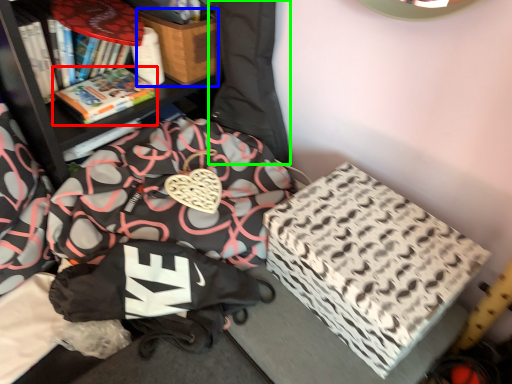
Question: Which object is positioned closest to book (highlighted by a red box)? Select from cardboard box (highlighted by a blue box) and bean bag chair (highlighted by a green box).

Choices:
 (A) cardboard box
 (B) bean bag chair

Answer: (A)